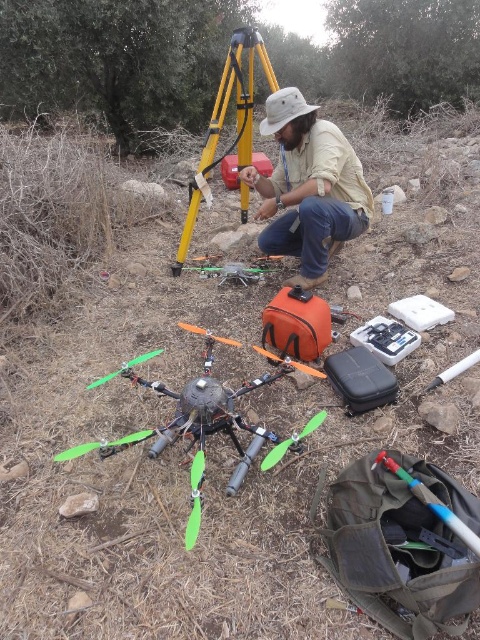
You are a field technician who just noticed that your drone has malfunctioned. You see the khaki cotton shirt at center and the green plastic propeller at center. Which object is located to the right of the other?

The khaki cotton shirt at center is to the right of the green plastic propeller at center.

You are a field technician who needs to retrieve the khaki cotton shirt at center from the ground. The drone is currently at point [309,188]. Can you safely move the drone to retrieve the shirt without moving it?

The khaki cotton shirt at center is located at point [309,188], which is the same location as the drone. Therefore, the drone is already positioned over the khaki cotton shirt at center, so you can retrieve it without moving the drone.